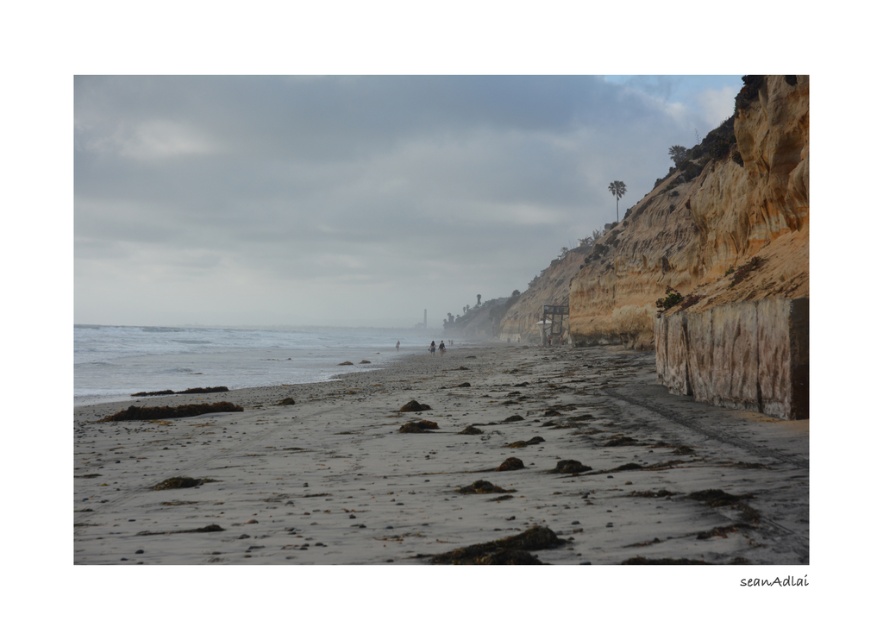
You are a photographer standing at the edge of the gray sandy beach at lower center and want to capture the blurred human figure at center in your shot. Based on the scene, which object is closer to you?

The gray sandy beach at lower center is closer to you since it is positioned in front of the blurred human figure at center.

You are a hiker planning to walk from the gray sandy beach at lower center to the brown rocky cliff at right. Which path would require climbing, and why?

The path to the brown rocky cliff at right would require climbing because the cliff is taller than the gray sandy beach at lower center.

You are standing at the point marked by the coordinates point (687, 230) in the coastal scene. Based on the image description, what natural feature are you most likely standing on?

The point (687, 230) indicates brown rocky cliff at right, so you are most likely standing on the brown rocky cliff at right.